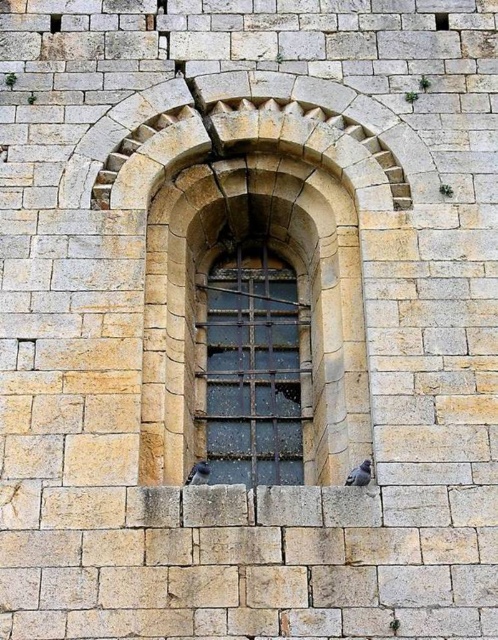
Question: Which object appears closest to the camera in this image?

Choices:
 (A) gray matte pigeon at lower center
 (B) dark glass window at center
 (C) gray matte pigeon at lower right

Answer: (C)

Question: Does dark glass window at center appear over gray matte pigeon at lower center?

Choices:
 (A) no
 (B) yes

Answer: (B)

Question: Can you confirm if dark glass window at center is positioned above gray matte pigeon at lower center?

Choices:
 (A) yes
 (B) no

Answer: (A)

Question: Which is farther from the dark glass window at center?

Choices:
 (A) gray matte pigeon at lower center
 (B) gray matte pigeon at lower right

Answer: (B)

Question: Can you confirm if dark glass window at center is positioned below gray matte pigeon at lower center?

Choices:
 (A) yes
 (B) no

Answer: (B)

Question: Among these objects, which one is nearest to the camera?

Choices:
 (A) dark glass window at center
 (B) gray matte pigeon at lower center
 (C) gray matte pigeon at lower right

Answer: (C)